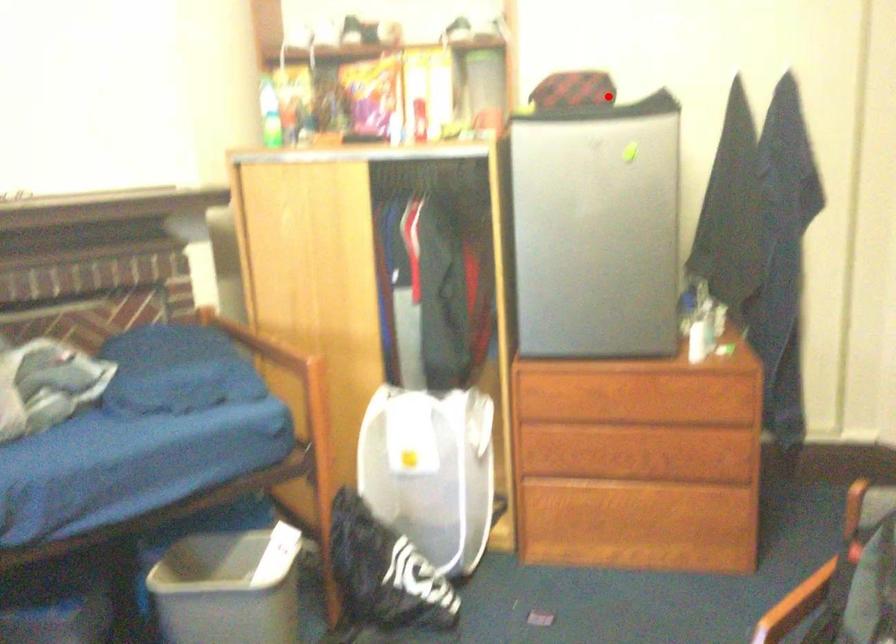
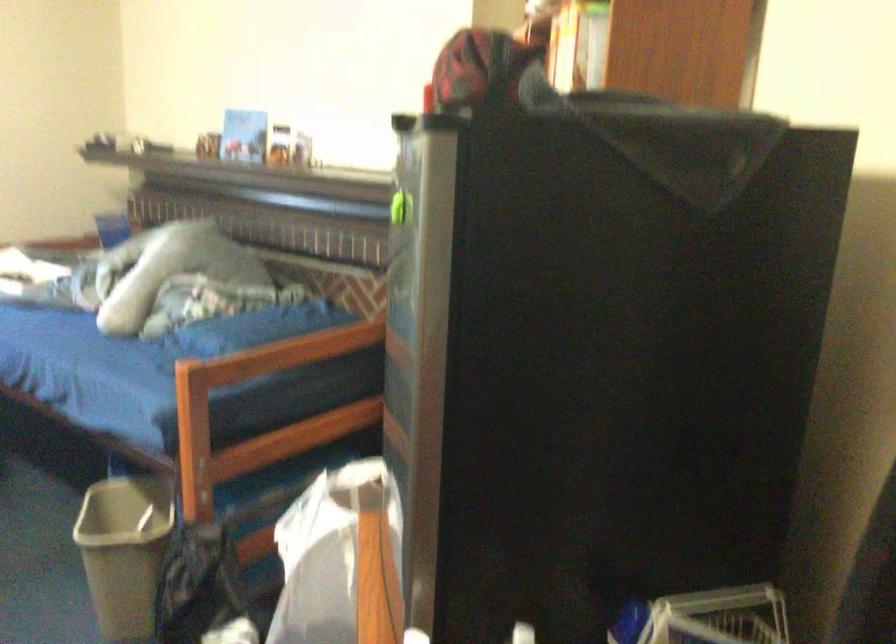
Question: I am providing you with two images of the same scene from different viewpoints. A red point is marked on the first image. Can you still see the location of the red point in image 2?

Choices:
 (A) Yes
 (B) No

Answer: (A)